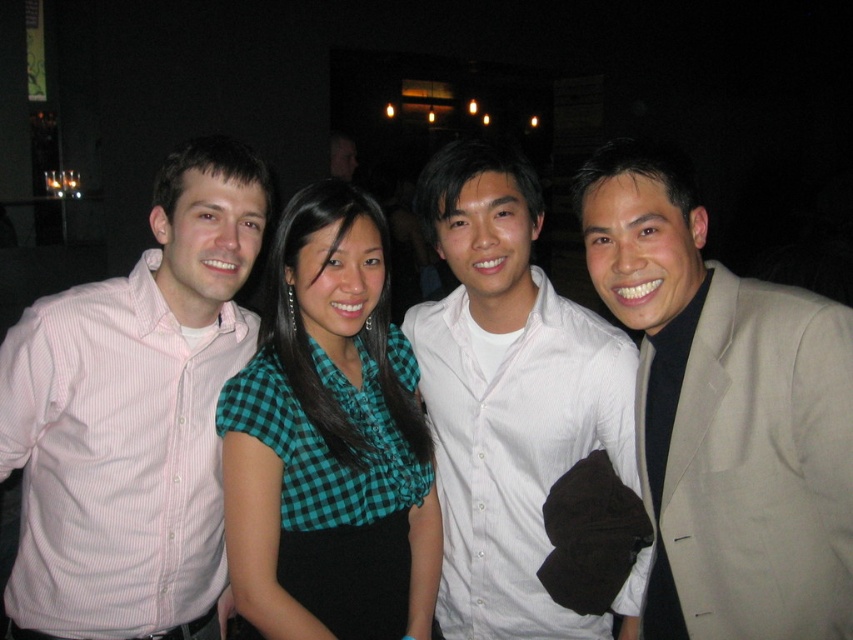
You are a photographer at the event and want to adjust the lighting so that the tan fabric suit at right and the green checkered blouse at center are equally illuminated. Which object should you move closer to the light source?

The tan fabric suit at right is positioned on the right side of green checkered blouse at center. Since it is further away from the light source, you should move the tan fabric suit at right closer to the light source to balance the illumination between both objects.

You are standing at the origin point of the coordinate system where the image is captured. Which of the two points, point (x=769, y=440) or point (x=395, y=368), is closer to you?

Point (x=769, y=440) is in front of point (x=395, y=368), so it is closer to you.